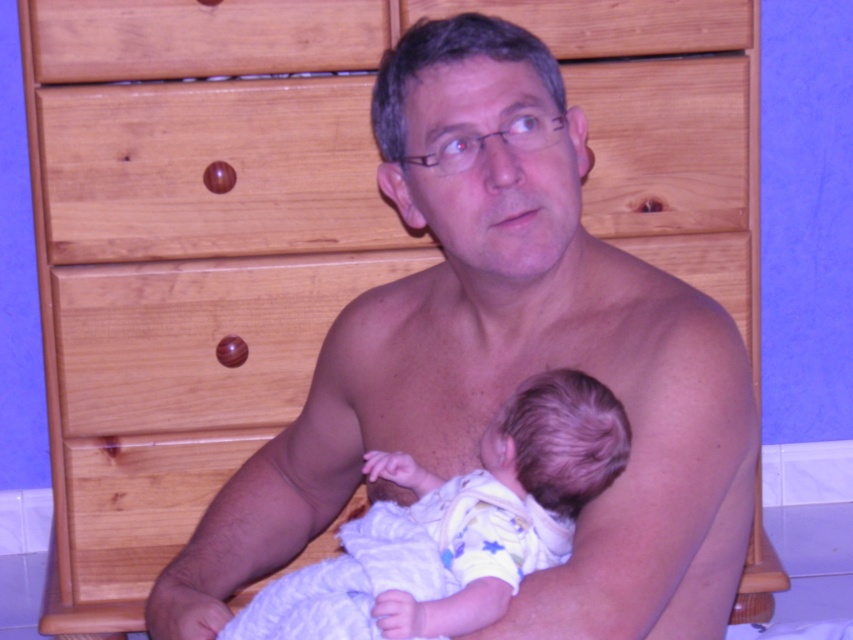
Question: Among these objects, which one is farthest from the camera?

Choices:
 (A) smooth skin man at center
 (B) white soft fabric baby at center

Answer: (A)

Question: Which point appears farthest from the camera in this image?

Choices:
 (A) (378, 461)
 (B) (508, 316)

Answer: (B)

Question: Observing the image, what is the correct spatial positioning of smooth skin man at center in reference to white soft fabric baby at center?

Choices:
 (A) above
 (B) below

Answer: (A)

Question: Can you confirm if smooth skin man at center is bigger than white soft fabric baby at center?

Choices:
 (A) yes
 (B) no

Answer: (A)

Question: Considering the relative positions of smooth skin man at center and white soft fabric baby at center in the image provided, where is smooth skin man at center located with respect to white soft fabric baby at center?

Choices:
 (A) left
 (B) right

Answer: (B)